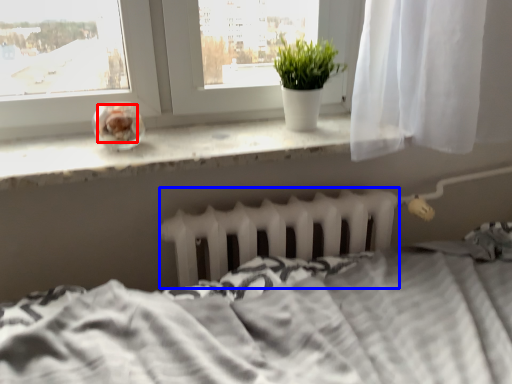
Question: Which of the following is the closest to the observer, food (highlighted by a red box) or radiator (highlighted by a blue box)?

Choices:
 (A) food
 (B) radiator

Answer: (A)